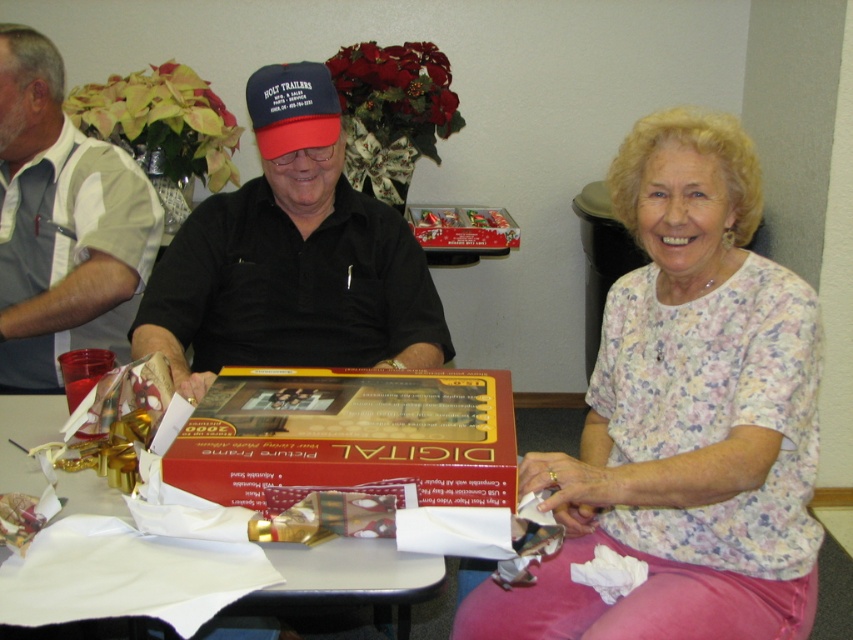
Question: Which point is farther to the camera?

Choices:
 (A) matte black cap at center
 (B) gray fabric shirt at left
 (C) matte blue baseball cap at center

Answer: (B)

Question: Which is farther from the floral fabric blouse at center?

Choices:
 (A) white paper at center
 (B) matte black cap at center
 (C) gray fabric shirt at left
 (D) matte blue baseball cap at center

Answer: (C)

Question: Does gray fabric shirt at left appear over white paper at center?

Choices:
 (A) no
 (B) yes

Answer: (B)

Question: Is gray fabric shirt at left below matte blue baseball cap at center?

Choices:
 (A) yes
 (B) no

Answer: (A)

Question: Does white paper at center appear on the left side of matte blue baseball cap at center?

Choices:
 (A) no
 (B) yes

Answer: (B)

Question: Which is farther from the gray fabric shirt at left?

Choices:
 (A) matte black cap at center
 (B) floral fabric blouse at center
 (C) white paper at center
 (D) matte blue baseball cap at center

Answer: (B)